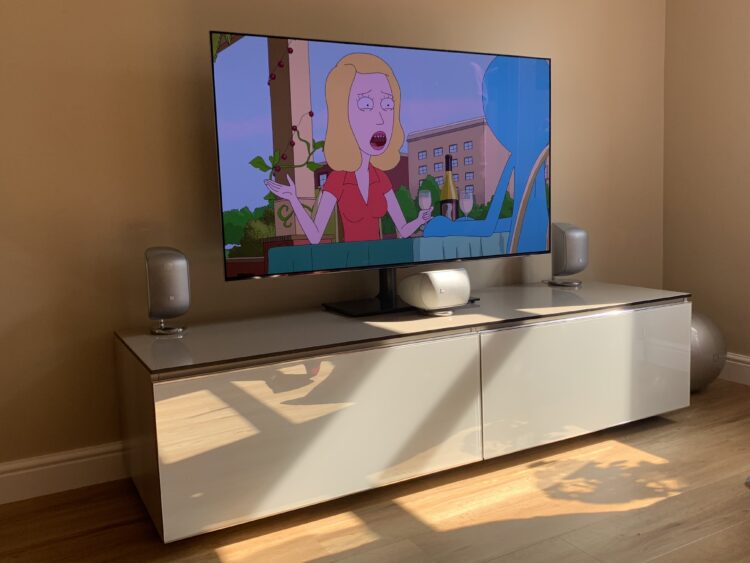
Find the location of `floor`. floor is located at coordinates (556, 519).